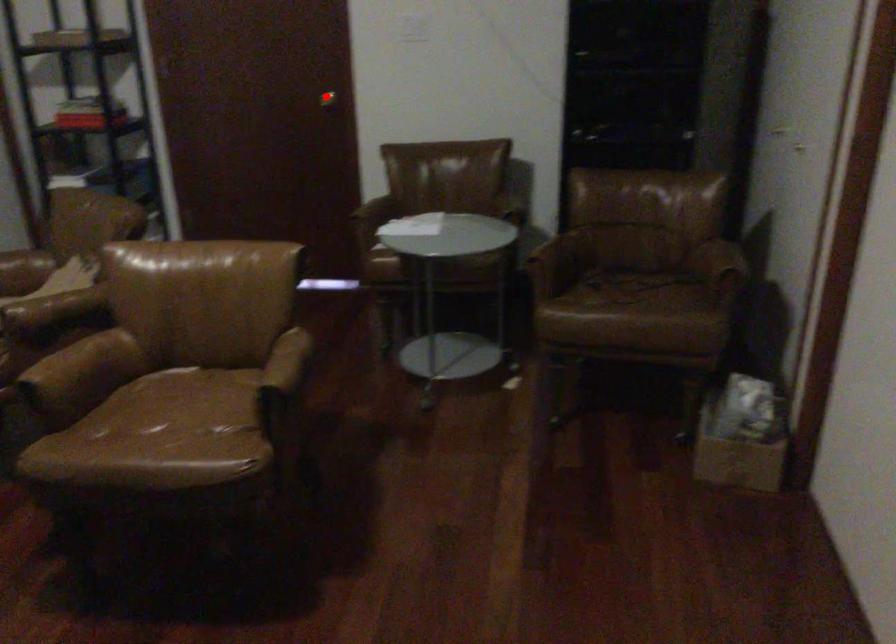
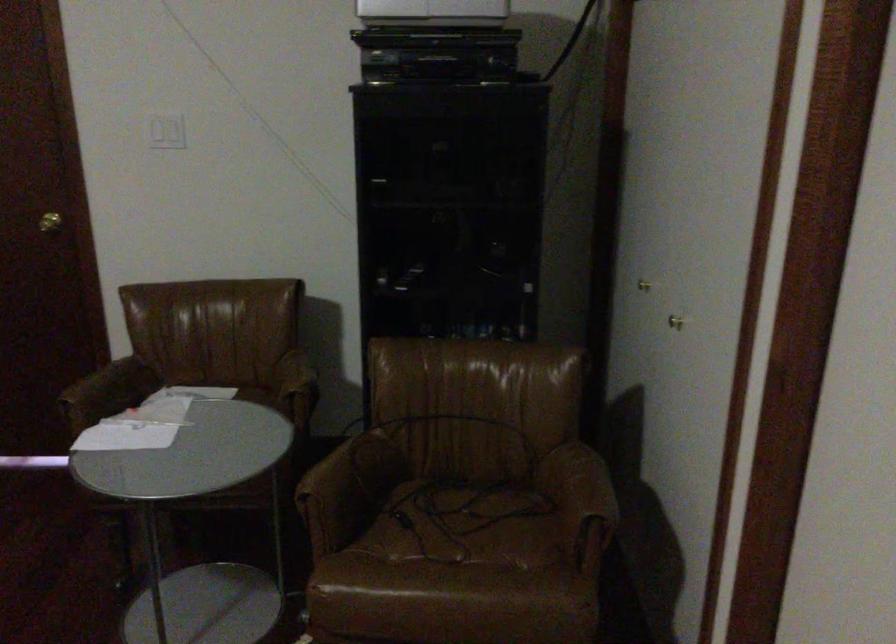
Question: I am providing you with two images of the same scene from different viewpoints. Image1 has a red point marked. In image2, the corresponding 3D location appears at what relative position? Reply with the corresponding letter.

Choices:
 (A) Closer
 (B) Farther

Answer: (A)